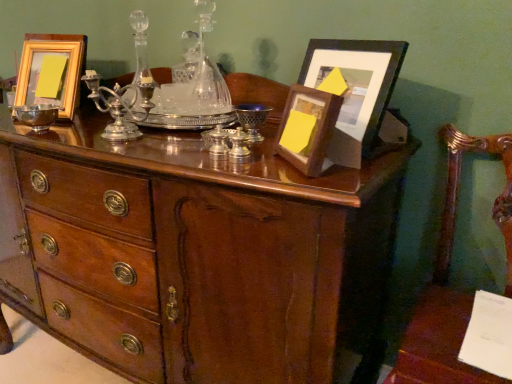
This screenshot has width=512, height=384. I want to click on free space in front of wooden picture frame at upper right, which is the second picture frame from left to right, so click(x=315, y=183).